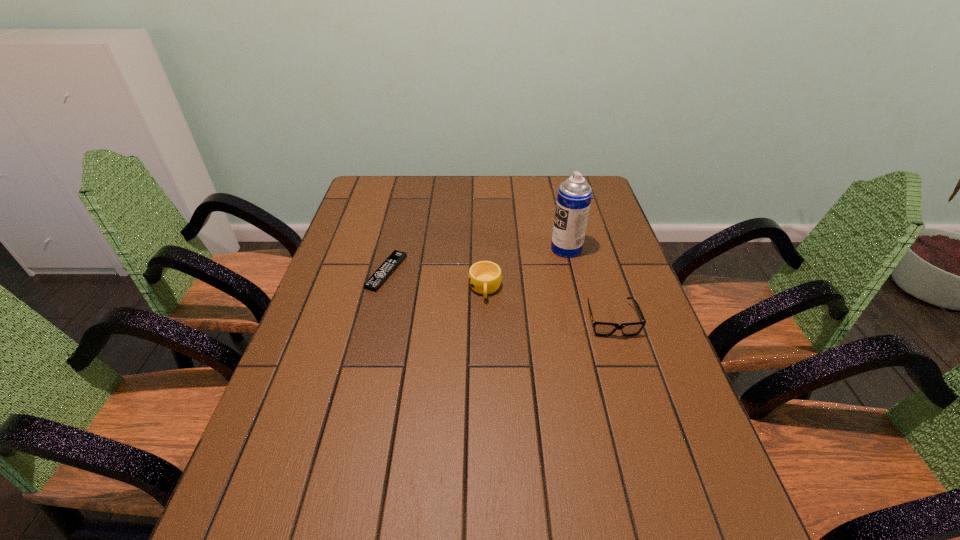
You are a GUI agent. You are given a task and a screenshot of the screen. Output one action in this format:
    pyautogui.click(x=<x>, y=<y>)
    Task: Click on the free spot between the third object from right to left and the sunglasses
    The image size is (960, 540).
    Given the screenshot: What is the action you would take?
    pyautogui.click(x=548, y=305)

Identify the location of blank region between the remote control and the second shortest object. Image resolution: width=960 pixels, height=540 pixels. (499, 296).

Where is `free spot between the third tallest object and the remote control`? Image resolution: width=960 pixels, height=540 pixels. free spot between the third tallest object and the remote control is located at coordinates (499, 296).

Locate an element on the screen. The width and height of the screenshot is (960, 540). vacant space in between the third tallest object and the tallest object is located at coordinates (588, 284).

The height and width of the screenshot is (540, 960). What are the coordinates of `free space between the second tallest object and the remote control` in the screenshot? It's located at (436, 280).

In order to click on unoccupied position between the shortest object and the cup in this screenshot , I will do `click(436, 280)`.

You are a GUI agent. You are given a task and a screenshot of the screen. Output one action in this format:
    pyautogui.click(x=<x>, y=<y>)
    Task: Click on the vacant area that lies between the second shortest object and the aerosol can
    The width and height of the screenshot is (960, 540).
    Given the screenshot: What is the action you would take?
    pyautogui.click(x=588, y=284)

Image resolution: width=960 pixels, height=540 pixels. Identify the location of free point between the aerosol can and the remote control. (476, 260).

At what (x,y) coordinates should I click in order to perform the action: click on vacant point located between the second shortest object and the remote control. Please return your answer as a coordinate pair (x, y). The image size is (960, 540). Looking at the image, I should click on (499, 296).

Where is `free space between the aerosol can and the second shortest object`? free space between the aerosol can and the second shortest object is located at coordinates (588, 284).